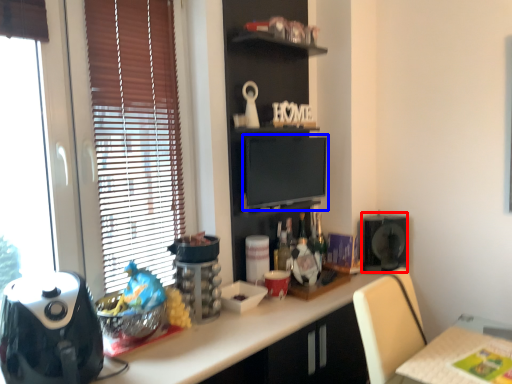
Question: Which object is further to the camera taking this photo, appliance (highlighted by a red box) or computer monitor (highlighted by a blue box)?

Choices:
 (A) appliance
 (B) computer monitor

Answer: (A)